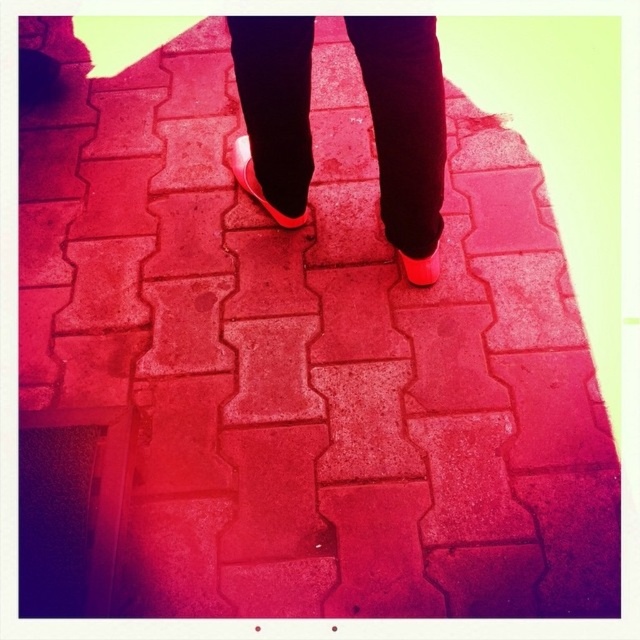
You are a photographer trying to capture the reflection of the shoes on the brick pavement. Since both the matte pink shoes at center and the shiny patent leather shoe at center are in the scene, which one do you think will show a better reflection?

The shiny patent leather shoe at center will show a better reflection because it has a smooth, reflective surface compared to the matte pink shoes at center.

You are a designer who wants to place a decorative stone exactly where the shiny patent leather shoe at center is currently standing. What coordinates should you use to place the stone?

You should place the decorative stone at coordinates point (257,182) where the shiny patent leather shoe at center is located.

You are a photographer trying to capture both the matte pink shoes at center and the matte rubber shoe at center in a single frame. Which shoe should you focus on to ensure the larger one is properly in focus?

The matte pink shoes at center is bigger than the matte rubber shoe at center, so you should focus on the matte pink shoes at center to ensure the larger one is properly in focus.